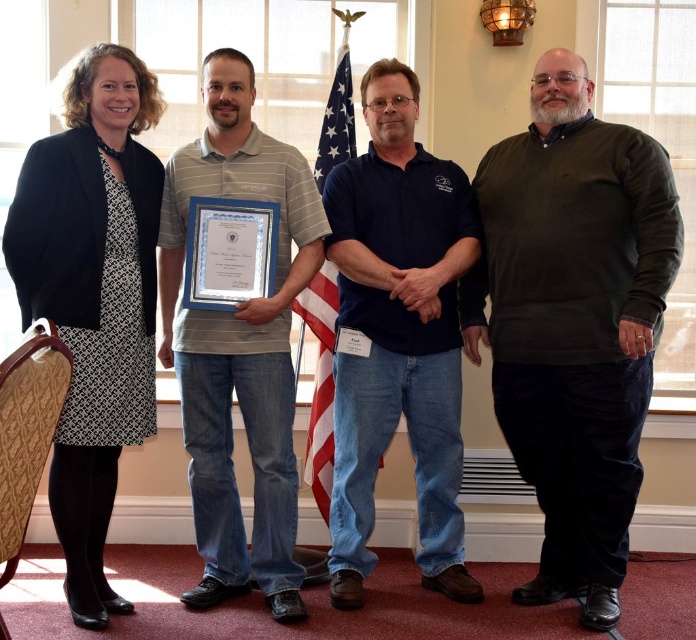
Which is below, blue cotton shirt at center or gray striped polo shirt at center?

gray striped polo shirt at center is below.

Does blue cotton shirt at center lie behind gray striped polo shirt at center?

Yes, it is.

What do you see at coordinates (397, 333) in the screenshot? This screenshot has height=640, width=696. I see `blue cotton shirt at center` at bounding box center [397, 333].

I want to click on blue cotton shirt at center, so click(397, 333).

Can you confirm if blue cotton shirt at center is positioned to the left of american flag at center?

In fact, blue cotton shirt at center is to the right of american flag at center.

Who is more forward, (473, 250) or (333, 131)?

Point (473, 250)

Between point (461, 218) and point (324, 419), which one is positioned behind?

The point (324, 419) is more distant.

Find the location of `blue cotton shirt at center`. blue cotton shirt at center is located at coordinates (397, 333).

Can you confirm if olive-green corduroy sweater at right is positioned to the right of gray striped polo shirt at center?

Indeed, olive-green corduroy sweater at right is positioned on the right side of gray striped polo shirt at center.

Is olive-green corduroy sweater at right shorter than gray striped polo shirt at center?

In fact, olive-green corduroy sweater at right may be taller than gray striped polo shirt at center.

Does point (489, 211) come closer to viewer compared to point (287, 513)?

That is False.

Where is `olive-green corduroy sweater at right`? This screenshot has height=640, width=696. olive-green corduroy sweater at right is located at coordinates (574, 321).